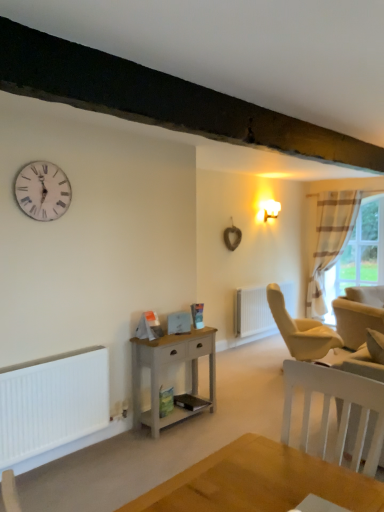
Locate an element on the screen. free region under white matte heater at lower left (from a real-world perspective) is located at coordinates (66, 458).